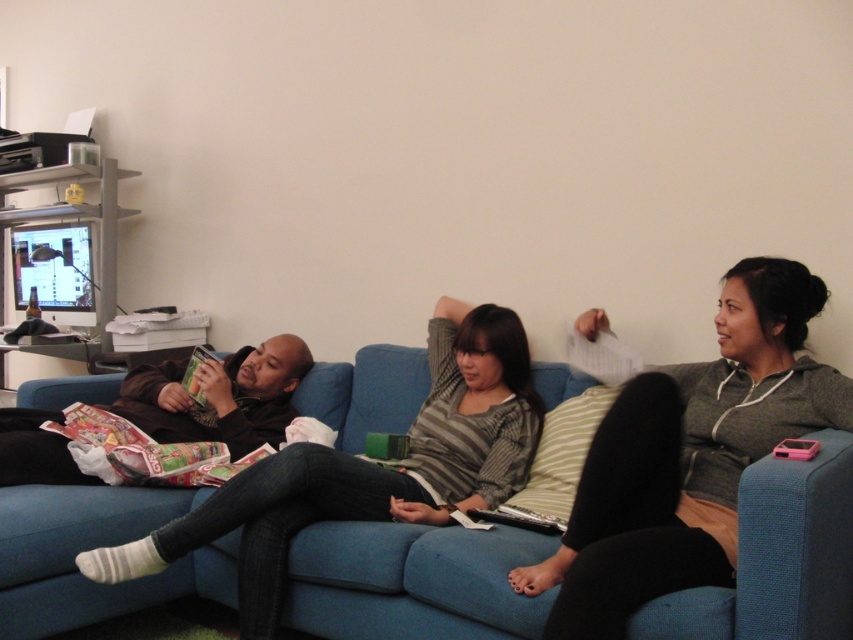
Who is positioned more to the left, striped sweater at center or matte brown jacket at center?

matte brown jacket at center

Can you confirm if striped sweater at center is positioned below matte brown jacket at center?

Yes, striped sweater at center is below matte brown jacket at center.

Between point (465, 484) and point (33, 460), which one is positioned behind?

The point (33, 460) is more distant.

Where is `striped sweater at center`? striped sweater at center is located at coordinates (368, 468).

Can you confirm if gray fleece hoodie at right is bigger than matte brown jacket at center?

Indeed, gray fleece hoodie at right has a larger size compared to matte brown jacket at center.

Is gray fleece hoodie at right taller than matte brown jacket at center?

Indeed, gray fleece hoodie at right has a greater height compared to matte brown jacket at center.

Is point (759, 330) farther from camera compared to point (148, 429)?

That is False.

The image size is (853, 640). I want to click on gray fleece hoodie at right, so click(x=688, y=456).

From the picture: Is striped sweater at center above matte green magazine at center?

No.

Is point (252, 593) in front of point (189, 394)?

Yes.

Where is `striped sweater at center`? This screenshot has width=853, height=640. striped sweater at center is located at coordinates (368, 468).